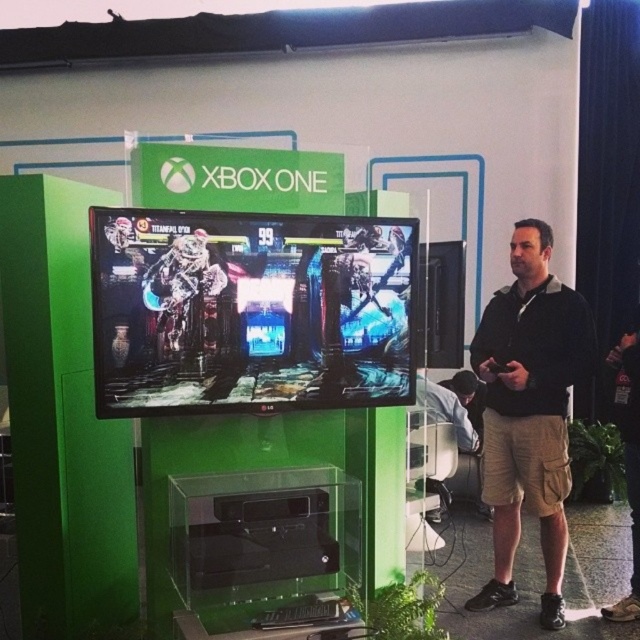
You are at a gaming event and see the shiny metallic screen at center and the black cotton shirt at center. Which object takes up more space in the image?

The black cotton shirt at center occupies more space than the shiny metallic screen at center.

You are a photographer at the event and want to capture a closeup of the Xbox One console. You have two points marked on your viewfinder at coordinates point [348,397] and point [532,371]. Which point should you focus on to get the Xbox One console in focus?

Point [348,397] is closer to the camera than point [532,371]. Therefore, focusing on point [348,397] will ensure the Xbox One console is in focus.